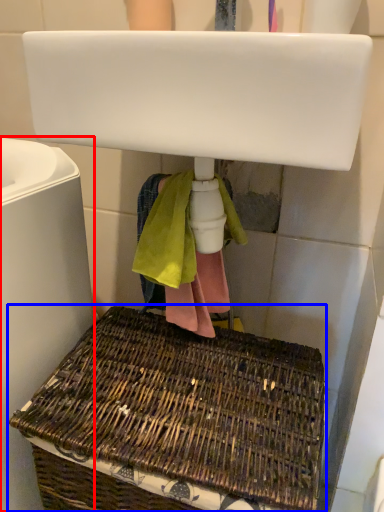
Question: Which of the following is the farthest to the observer, bath (highlighted by a red box) or picnic basket (highlighted by a blue box)?

Choices:
 (A) bath
 (B) picnic basket

Answer: (B)